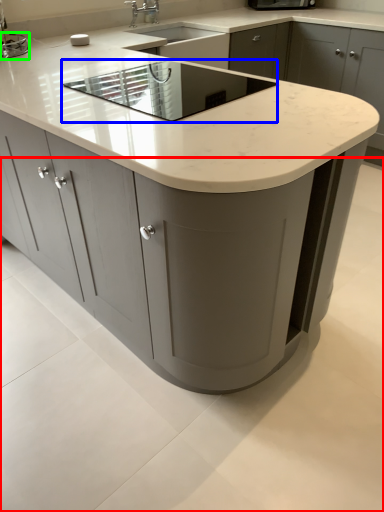
Question: Considering the real-world distances, which object is farthest from concrete (highlighted by a red box)? appliance (highlighted by a blue box) or appliance (highlighted by a green box)?

Choices:
 (A) appliance
 (B) appliance

Answer: (B)